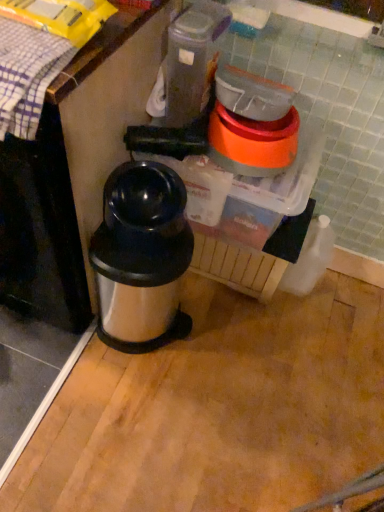
Question: Is plaid fabric at upper left to the right of black plastic blender at center from the viewer's perspective?

Choices:
 (A) no
 (B) yes

Answer: (A)

Question: Can you confirm if plaid fabric at upper left is bigger than black plastic blender at center?

Choices:
 (A) no
 (B) yes

Answer: (A)

Question: Considering the relative positions of plaid fabric at upper left and black plastic blender at center in the image provided, is plaid fabric at upper left to the left of black plastic blender at center from the viewer's perspective?

Choices:
 (A) no
 (B) yes

Answer: (B)

Question: From the image's perspective, is plaid fabric at upper left beneath black plastic blender at center?

Choices:
 (A) no
 (B) yes

Answer: (A)

Question: Does plaid fabric at upper left have a greater height compared to black plastic blender at center?

Choices:
 (A) yes
 (B) no

Answer: (B)

Question: Is point (137, 327) positioned closer to the camera than point (203, 173)?

Choices:
 (A) farther
 (B) closer

Answer: (A)

Question: Is silver metallic thermos at center wider or thinner than black plastic blender at center?

Choices:
 (A) thin
 (B) wide

Answer: (A)

Question: From their relative heights in the image, would you say silver metallic thermos at center is taller or shorter than black plastic blender at center?

Choices:
 (A) tall
 (B) short

Answer: (A)

Question: Is silver metallic thermos at center in front of or behind black plastic blender at center in the image?

Choices:
 (A) front
 (B) behind

Answer: (A)

Question: In terms of width, does black plastic blender at center look wider or thinner when compared to silver metallic thermos at center?

Choices:
 (A) thin
 (B) wide

Answer: (B)

Question: From the image's perspective, is black plastic blender at center above or below silver metallic thermos at center?

Choices:
 (A) below
 (B) above

Answer: (B)

Question: Considering the positions of black plastic blender at center and silver metallic thermos at center in the image, is black plastic blender at center taller or shorter than silver metallic thermos at center?

Choices:
 (A) short
 (B) tall

Answer: (A)

Question: Considering the relative positions of black plastic blender at center and silver metallic thermos at center in the image provided, is black plastic blender at center to the left or to the right of silver metallic thermos at center?

Choices:
 (A) right
 (B) left

Answer: (A)

Question: Visually, is plaid fabric at upper left positioned to the left or to the right of black plastic blender at center?

Choices:
 (A) left
 (B) right

Answer: (A)

Question: Is plaid fabric at upper left in front of or behind black plastic blender at center in the image?

Choices:
 (A) behind
 (B) front

Answer: (B)